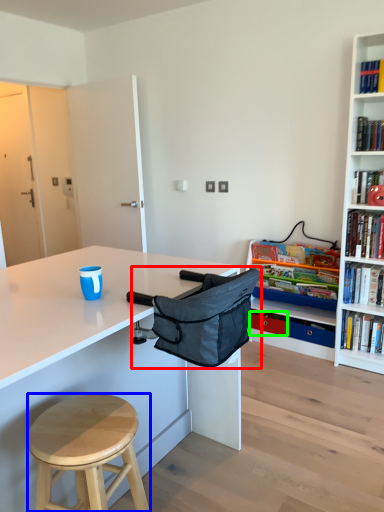
Question: Based on their relative distances, which object is farther from folding chair (highlighted by a red box)? Choose from stool (highlighted by a blue box) and drawer (highlighted by a green box).

Choices:
 (A) stool
 (B) drawer

Answer: (B)